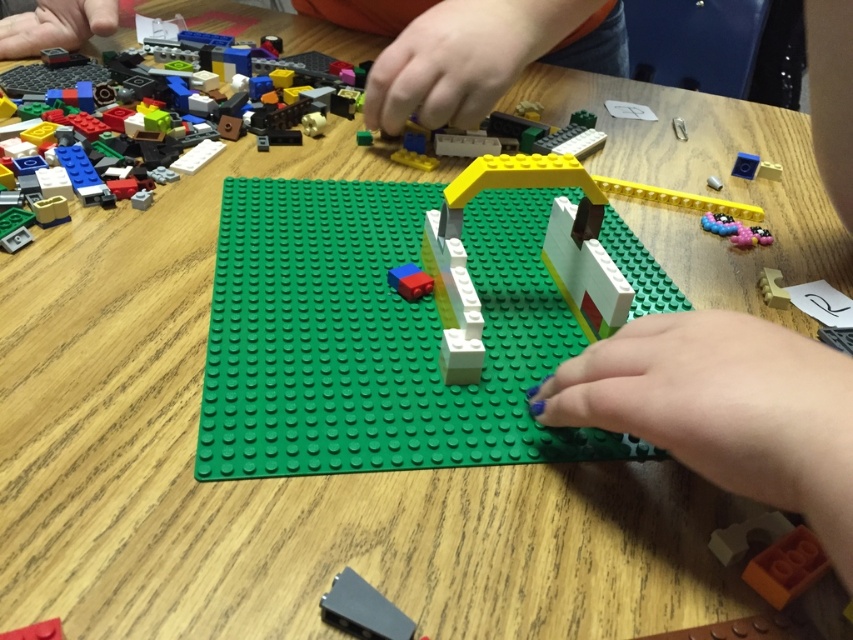
Who is lower down, white matte house at center or translucent yellow plastic at upper center?

white matte house at center is below.

Which is above, white matte house at center or translucent yellow plastic at upper center?

translucent yellow plastic at upper center

Identify the location of white matte house at center. (410, 320).

This screenshot has width=853, height=640. I want to click on white matte house at center, so click(410, 320).

Is point (508, 316) positioned after point (412, 280)?

No, it is in front of (412, 280).

Between white matte house at center and matte blue brick at center, which one appears on the right side from the viewer's perspective?

Positioned to the right is matte blue brick at center.

Which is in front, point (349, 397) or point (408, 276)?

Point (349, 397)

I want to click on white matte house at center, so click(x=410, y=320).

From the picture: Is translucent yellow plastic at upper center to the left of black plastic piece at lower center from the viewer's perspective?

Incorrect, translucent yellow plastic at upper center is not on the left side of black plastic piece at lower center.

Which is below, translucent yellow plastic at upper center or black plastic piece at lower center?

black plastic piece at lower center

Is point (590, 144) less distant than point (345, 570)?

No, it is behind (345, 570).

In order to click on translucent yellow plastic at upper center in this screenshot , I will do `click(544, 134)`.